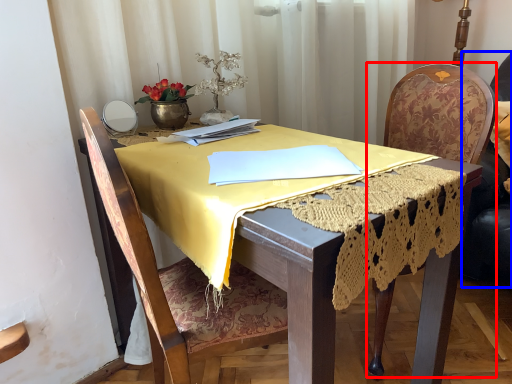
Question: Among these objects, which one is nearest to the camera, chair (highlighted by a red box) or swivel chair (highlighted by a blue box)?

Choices:
 (A) chair
 (B) swivel chair

Answer: (A)